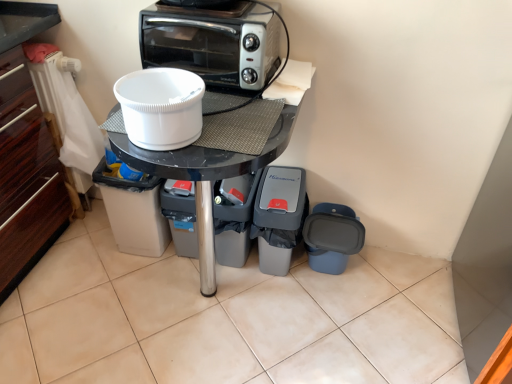
Where is `free spot to the left of blue plastic trash can at lower right, the fifth appliance when ordered from left to right`? This screenshot has height=384, width=512. free spot to the left of blue plastic trash can at lower right, the fifth appliance when ordered from left to right is located at coordinates (278, 292).